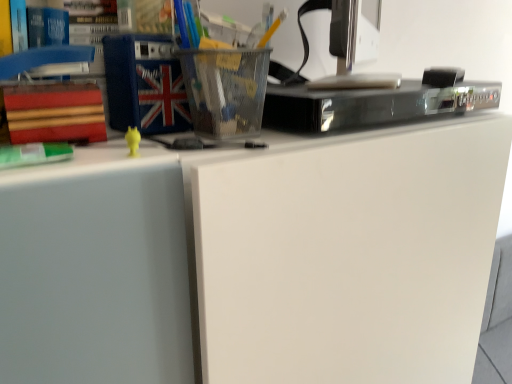
Question: From the image's perspective, does green matte book at left appear lower than red matte book at left, the first paperback book when ordered from left to right?

Choices:
 (A) no
 (B) yes

Answer: (B)

Question: Is green matte book at left surrounding red matte book at left, positioned as the 1th paperback book in bottom-to-top order?

Choices:
 (A) yes
 (B) no

Answer: (B)

Question: Are green matte book at left and red matte book at left, placed as the second paperback book when sorted from right to left, beside each other?

Choices:
 (A) no
 (B) yes

Answer: (B)

Question: Is green matte book at left far from red matte book at left, placed as the second paperback book when sorted from right to left?

Choices:
 (A) yes
 (B) no

Answer: (B)

Question: Is green matte book at left in front of red matte book at left, positioned as the 1th paperback book in bottom-to-top order?

Choices:
 (A) no
 (B) yes

Answer: (B)

Question: Looking at the image, does metallic silver desktop computer at upper right seem bigger or smaller compared to black glossy dvd player at upper center?

Choices:
 (A) small
 (B) big

Answer: (B)

Question: In terms of height, does metallic silver desktop computer at upper right look taller or shorter compared to black glossy dvd player at upper center?

Choices:
 (A) tall
 (B) short

Answer: (A)

Question: Considering the positions of metallic silver desktop computer at upper right and black glossy dvd player at upper center in the image, is metallic silver desktop computer at upper right wider or thinner than black glossy dvd player at upper center?

Choices:
 (A) thin
 (B) wide

Answer: (A)

Question: From the image's perspective, relative to black glossy dvd player at upper center, is metallic silver desktop computer at upper right above or below?

Choices:
 (A) above
 (B) below

Answer: (A)

Question: From a real-world perspective, relative to black glossy dvd player at upper center, is blue fabric book at upper left, acting as the first paperback book starting from the top, vertically above or below?

Choices:
 (A) above
 (B) below

Answer: (A)

Question: Based on their positions, is blue fabric book at upper left, acting as the first paperback book starting from the top, located to the left or right of black glossy dvd player at upper center?

Choices:
 (A) right
 (B) left

Answer: (B)

Question: Is blue fabric book at upper left, the 2th paperback book when ordered from left to right, bigger or smaller than black glossy dvd player at upper center?

Choices:
 (A) big
 (B) small

Answer: (B)

Question: Is blue fabric book at upper left, which is the second paperback book in bottom-to-top order, taller or shorter than black glossy dvd player at upper center?

Choices:
 (A) tall
 (B) short

Answer: (A)

Question: Considering the positions of point (174, 82) and point (328, 84), is point (174, 82) closer or farther from the camera than point (328, 84)?

Choices:
 (A) closer
 (B) farther

Answer: (A)

Question: Is blue fabric book at upper left, which is the second paperback book in bottom-to-top order, inside the boundaries of metallic silver desktop computer at upper right, or outside?

Choices:
 (A) outside
 (B) inside

Answer: (A)